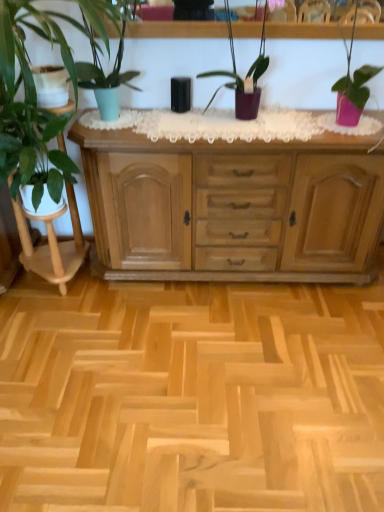
Question: Is pink matte pot at right, which is counted as the 4th houseplant, starting from the left, thinner than purple matte plant at center, the 2th houseplant in the right-to-left sequence?

Choices:
 (A) no
 (B) yes

Answer: (A)

Question: Considering the relative positions of pink matte pot at right, which is counted as the 4th houseplant, starting from the left, and purple matte plant at center, the third houseplant when ordered from left to right, in the image provided, is pink matte pot at right, which is counted as the 4th houseplant, starting from the left, behind purple matte plant at center, the third houseplant when ordered from left to right,?

Choices:
 (A) no
 (B) yes

Answer: (A)

Question: Is pink matte pot at right, which is counted as the 4th houseplant, starting from the left, positioned far away from purple matte plant at center, the third houseplant when ordered from left to right?

Choices:
 (A) no
 (B) yes

Answer: (A)

Question: From a real-world perspective, is pink matte pot at right, which is counted as the 4th houseplant, starting from the left, positioned under purple matte plant at center, the third houseplant when ordered from left to right, based on gravity?

Choices:
 (A) yes
 (B) no

Answer: (B)

Question: From the image's perspective, does pink matte pot at right, which is counted as the 4th houseplant, starting from the left, appear lower than purple matte plant at center, the 2th houseplant in the right-to-left sequence?

Choices:
 (A) yes
 (B) no

Answer: (A)

Question: Is pink matte pot at right, the 1th houseplant viewed from the right, closer to camera compared to purple matte plant at center, the third houseplant when ordered from left to right?

Choices:
 (A) yes
 (B) no

Answer: (A)

Question: Is natural wood cabinet at center outside of white glossy plant stand at left?

Choices:
 (A) no
 (B) yes

Answer: (B)

Question: Does natural wood cabinet at center come in front of white glossy plant stand at left?

Choices:
 (A) no
 (B) yes

Answer: (A)

Question: Is white glossy plant stand at left at the back of natural wood cabinet at center?

Choices:
 (A) yes
 (B) no

Answer: (B)

Question: Is white glossy plant stand at left surrounded by natural wood cabinet at center?

Choices:
 (A) no
 (B) yes

Answer: (A)

Question: Can you confirm if natural wood cabinet at center is bigger than white glossy plant stand at left?

Choices:
 (A) yes
 (B) no

Answer: (A)

Question: From the image's perspective, is natural wood cabinet at center on white glossy plant stand at left?

Choices:
 (A) yes
 (B) no

Answer: (B)

Question: From the image's perspective, is white glossy plant stand at left on pink matte pot at right, the 1th houseplant viewed from the right?

Choices:
 (A) no
 (B) yes

Answer: (A)